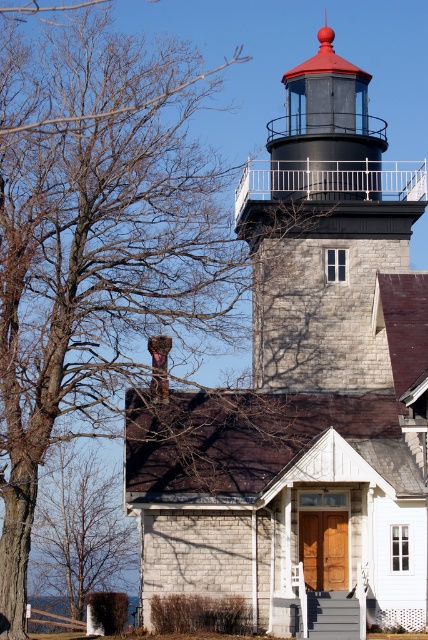
You are standing at the center of the image. Which direction should you move to reach the dark gray stone lighthouse at center?

The dark gray stone lighthouse at center is already at the center of the image, so you don not need to move in any direction to reach it.

You are a visitor standing at the base of the dark gray stone lighthouse at center and want to take a photo of the brown bark tree at lower left. Will the tree be fully visible in the photo if you stand at the lighthouse base?

The dark gray stone lighthouse at center is taller than the brown bark tree at lower left, so the tree will be fully visible in the photo taken from the lighthouse base since it is shorter and positioned lower left.

You are standing at the base of the dark gray stone lighthouse at center and want to walk to the brown bark tree at lower left. Which direction should you move relative to the lighthouse?

You should move downward from the dark gray stone lighthouse at center to reach the brown bark tree at lower left since the lighthouse is positioned over the tree.